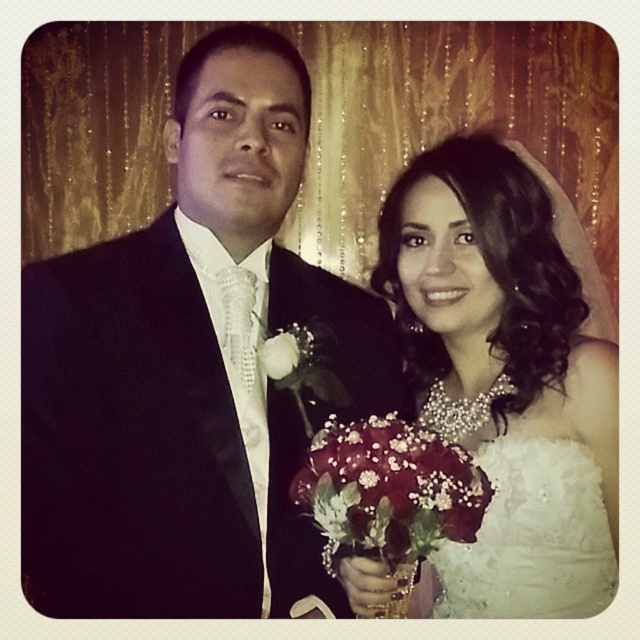
You are a photographer taking a portrait of the couple. You want to ensure the velvety red roses at center and the white satin dress at center are both clearly visible. Which object should you focus on to ensure both are in focus?

You should focus on the white satin dress at center because the velvety red roses at center is behind it, so focusing on the closer object will keep both in focus.

You are a photographer who needs to adjust the camera focus between the velvety red roses at center and the white silk rose at center. Can you focus on both objects simultaneously if your camera has a depth of field that can cover 10 inches?

The distance between the velvety red roses at center and the white silk rose at center is 9.14 inches, which is less than the camera depth of field of 10 inches. Therefore, both objects can be in focus simultaneously.